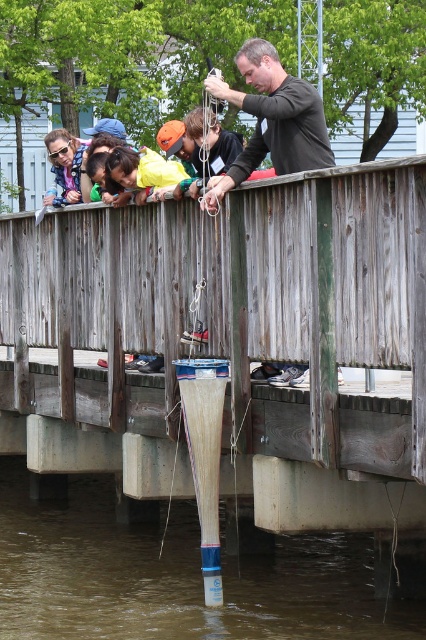
Can you confirm if transparent plastic tube at lower center is positioned to the left of matte black shirt at upper center?

Indeed, transparent plastic tube at lower center is positioned on the left side of matte black shirt at upper center.

Between transparent plastic tube at lower center and matte black shirt at upper center, which one is positioned higher?

matte black shirt at upper center is above.

The width and height of the screenshot is (426, 640). Find the location of `transparent plastic tube at lower center`. transparent plastic tube at lower center is located at coordinates point(175,577).

I want to click on transparent plastic tube at lower center, so click(175, 577).

At what (x,y) coordinates should I click in order to perform the action: click on transparent plastic tube at lower center. Please return your answer as a coordinate pair (x, y). The width and height of the screenshot is (426, 640). Looking at the image, I should click on click(x=175, y=577).

Who is more distant from viewer, (9, 604) or (152, 176)?

The point (9, 604) is behind.

Where is `transparent plastic tube at lower center`? The width and height of the screenshot is (426, 640). transparent plastic tube at lower center is located at coordinates (175, 577).

Between matte black shirt at upper center and yellow shirt at upper left, which one has more height?

With more height is matte black shirt at upper center.

This screenshot has width=426, height=640. I want to click on matte black shirt at upper center, so click(271, 120).